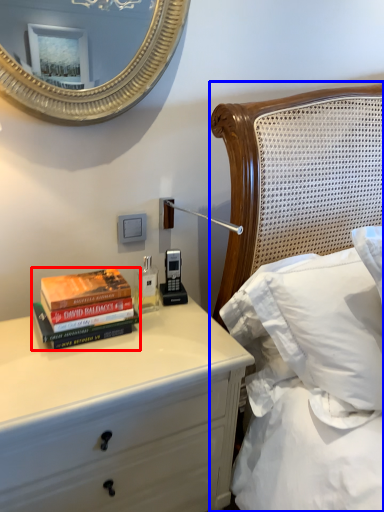
Question: Which object is closer to the camera taking this photo, book (highlighted by a red box) or bed (highlighted by a blue box)?

Choices:
 (A) book
 (B) bed

Answer: (B)